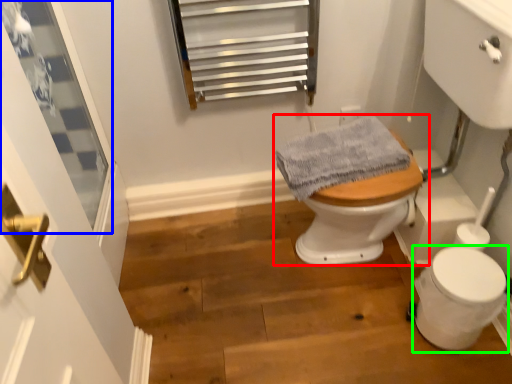
Question: Based on their relative distances, which object is nearer to toilet (highlighted by a red box)? Choose from window (highlighted by a blue box) and toilet bowl (highlighted by a green box).

Choices:
 (A) window
 (B) toilet bowl

Answer: (B)